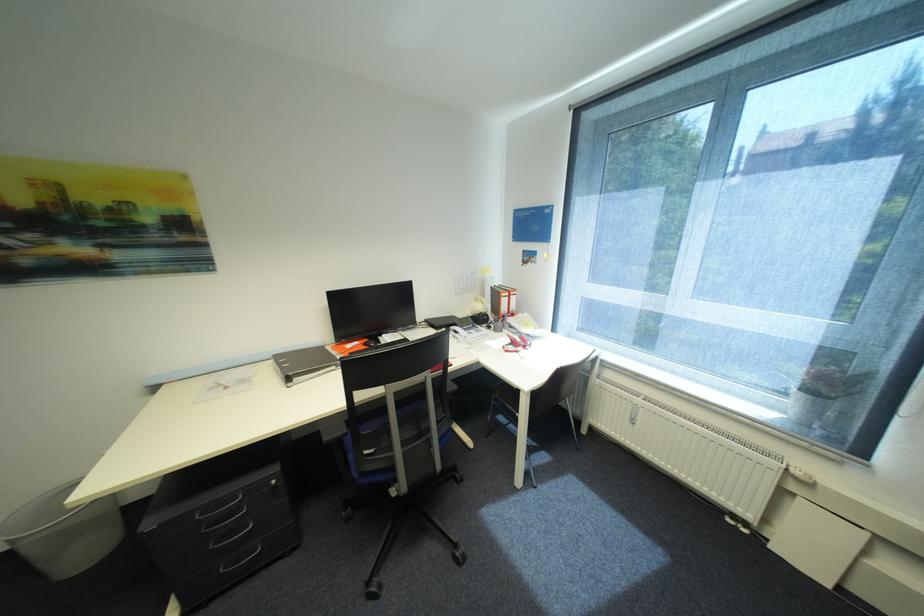
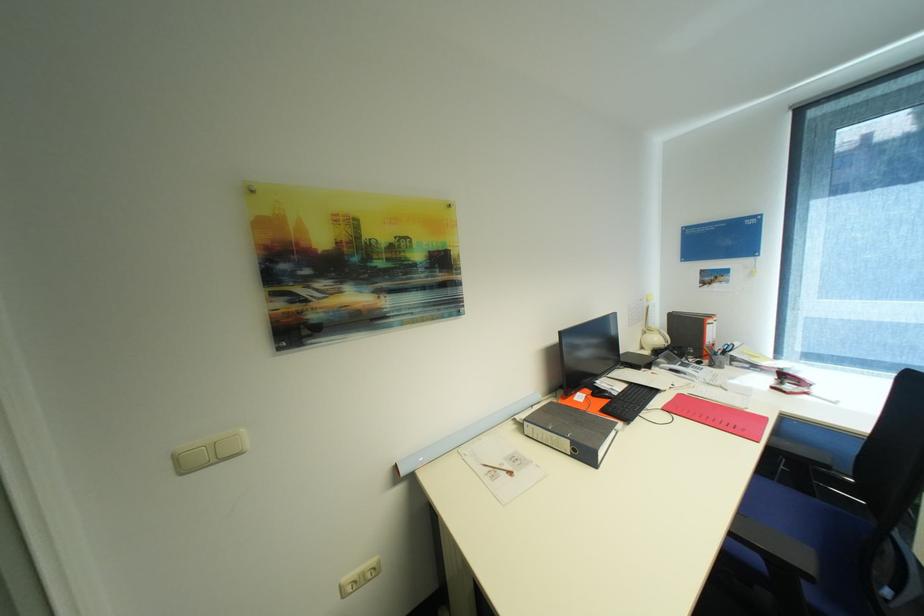
Question: Which direction would the cameraman need to move to produce the second image? Reply with the corresponding letter.

Choices:
 (A) Left
 (B) Right
 (C) Forward
 (D) Backward

Answer: (A)